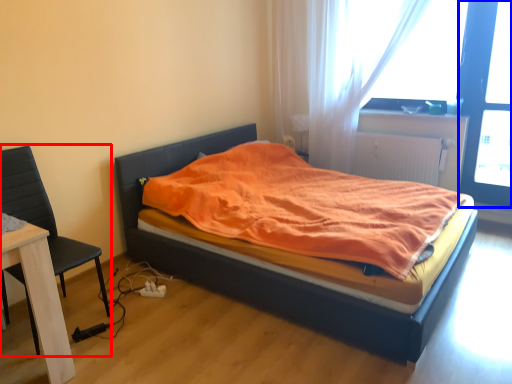
Question: Which point is closer to the camera, chair (highlighted by a red box) or screen door (highlighted by a blue box)?

Choices:
 (A) chair
 (B) screen door

Answer: (A)